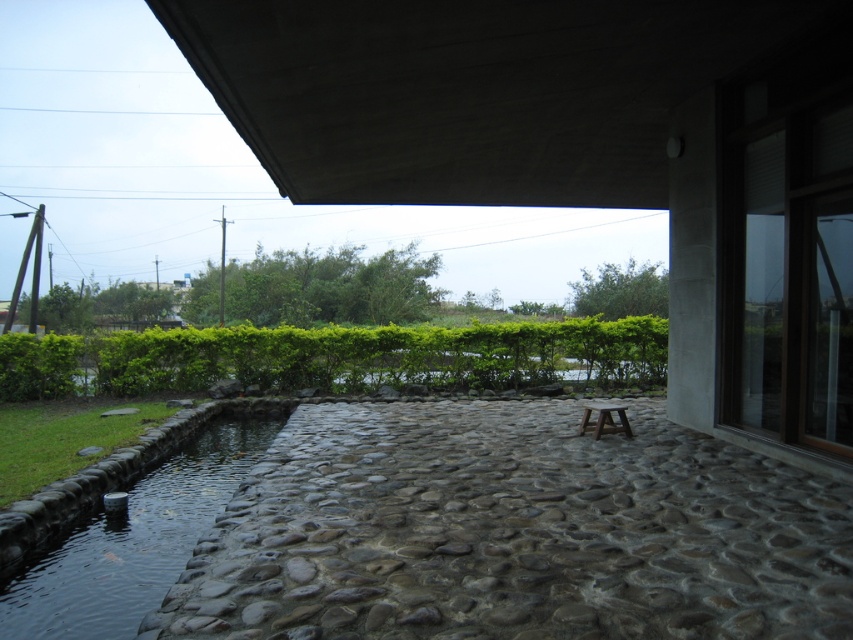
Question: Is green leafy hedge at center below clear water at pond left?

Choices:
 (A) yes
 (B) no

Answer: (B)

Question: Can you confirm if green leafy hedge at center is positioned to the left of clear water at pond left?

Choices:
 (A) no
 (B) yes

Answer: (B)

Question: Is green leafy hedge at center above clear water at pond left?

Choices:
 (A) no
 (B) yes

Answer: (B)

Question: Among these objects, which one is farthest from the camera?

Choices:
 (A) green leafy hedge at center
 (B) clear water at pond left

Answer: (A)

Question: Which object appears farthest from the camera in this image?

Choices:
 (A) green leafy hedge at center
 (B) clear water at pond left

Answer: (A)